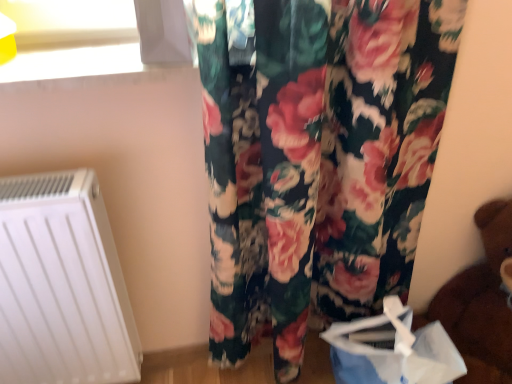
Question: Considering the positions of point (74, 364) and point (433, 362), is point (74, 364) closer or farther from the camera than point (433, 362)?

Choices:
 (A) closer
 (B) farther

Answer: (B)

Question: In the image, is white matte radiator at lower left positioned in front of or behind blue paper bag at lower right?

Choices:
 (A) front
 (B) behind

Answer: (A)

Question: Which is farther from the white matte radiator at lower left?

Choices:
 (A) brown plush bear at lower right
 (B) blue paper bag at lower right

Answer: (A)

Question: Based on their relative distances, which object is farther from the brown plush bear at lower right?

Choices:
 (A) white matte radiator at lower left
 (B) blue paper bag at lower right

Answer: (A)